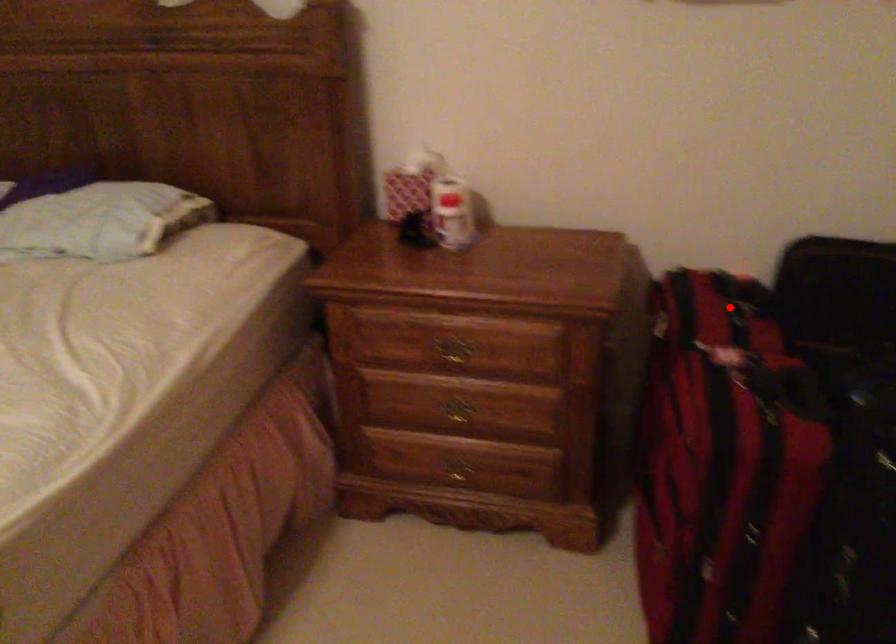
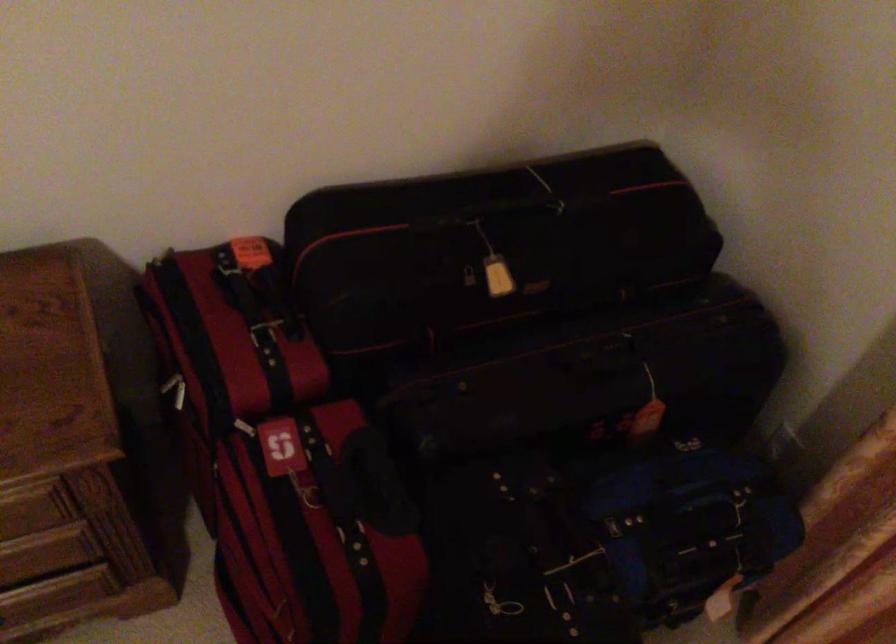
Question: I am providing you with two images of the same scene from different viewpoints. A red point is shown in image1. For the corresponding object point in image2, is it positioned nearer or farther from the camera?

Choices:
 (A) Nearer
 (B) Farther

Answer: (A)